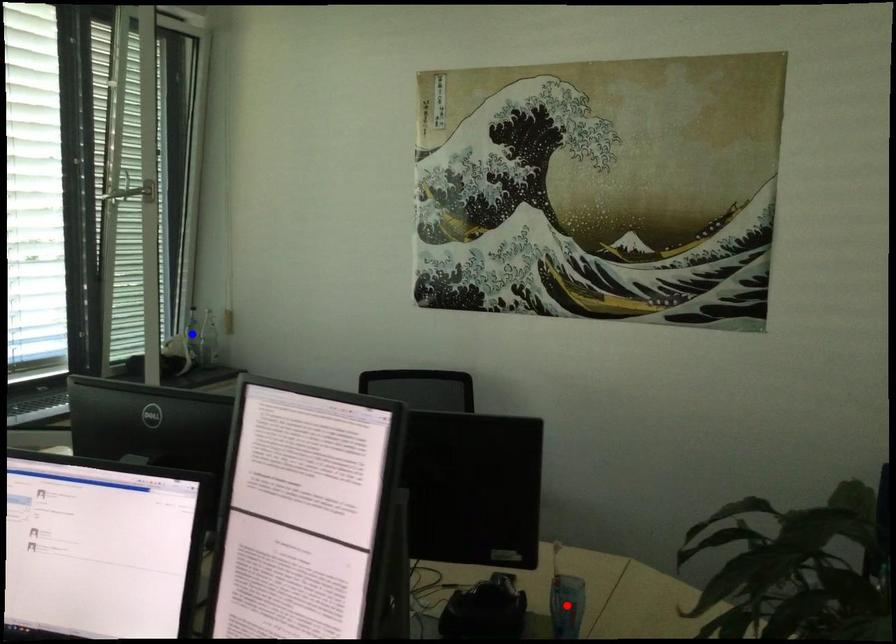
Question: Two points are marked on the image. Which point is closer to the camera?

Choices:
 (A) Blue point is closer.
 (B) Red point is closer.

Answer: (B)